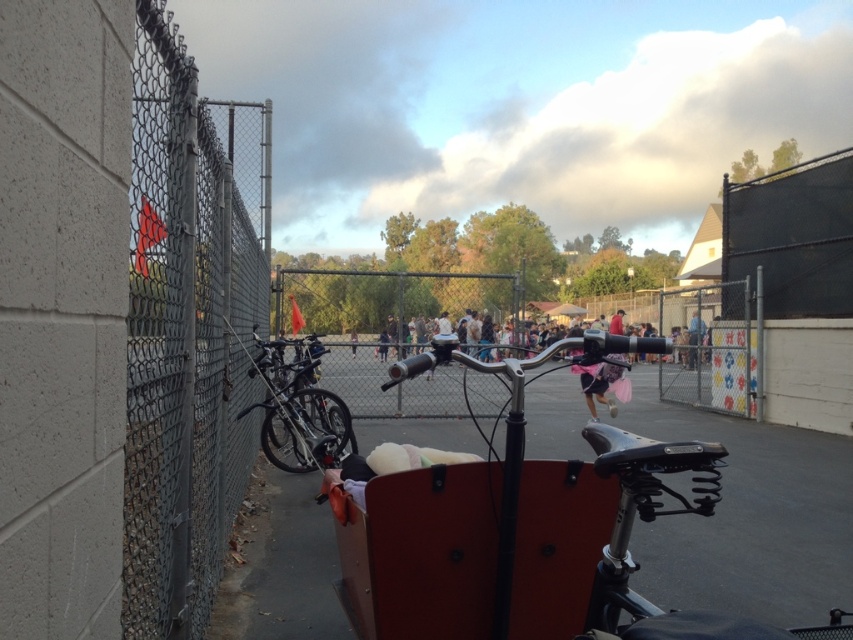
Measure the distance between black mesh fence at upper right and camera.

12.00 meters

Can you confirm if black mesh fence at upper right is positioned to the right of shiny black bicycle at left?

Indeed, black mesh fence at upper right is positioned on the right side of shiny black bicycle at left.

Between point (766, 193) and point (337, 424), which one is positioned in front?

Point (337, 424) is more forward.

Where is `black mesh fence at upper right`? black mesh fence at upper right is located at coordinates (793, 236).

Does shiny black bicycle at left have a smaller size compared to pink fabric at center?

Actually, shiny black bicycle at left might be larger than pink fabric at center.

Where is `shiny black bicycle at left`? Image resolution: width=853 pixels, height=640 pixels. shiny black bicycle at left is located at coordinates (300, 420).

Locate an element on the screen. shiny black bicycle at left is located at coordinates (300, 420).

Is black mesh fence at upper right positioned at the back of pink fabric at center?

Yes, black mesh fence at upper right is behind pink fabric at center.

Who is positioned more to the right, black mesh fence at upper right or pink fabric at center?

black mesh fence at upper right is more to the right.

Image resolution: width=853 pixels, height=640 pixels. What do you see at coordinates (793, 236) in the screenshot?
I see `black mesh fence at upper right` at bounding box center [793, 236].

Identify the location of black mesh fence at upper right. (793, 236).